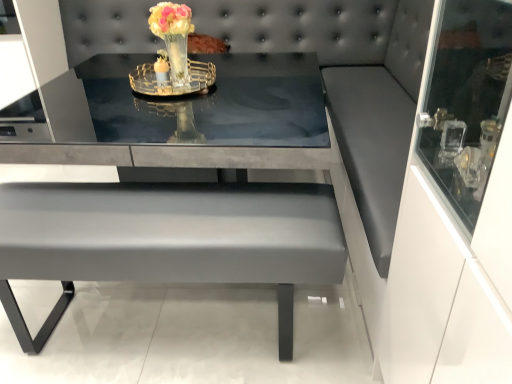
I want to click on vacant area that lies to the right of translucent glass vase at center, so click(231, 90).